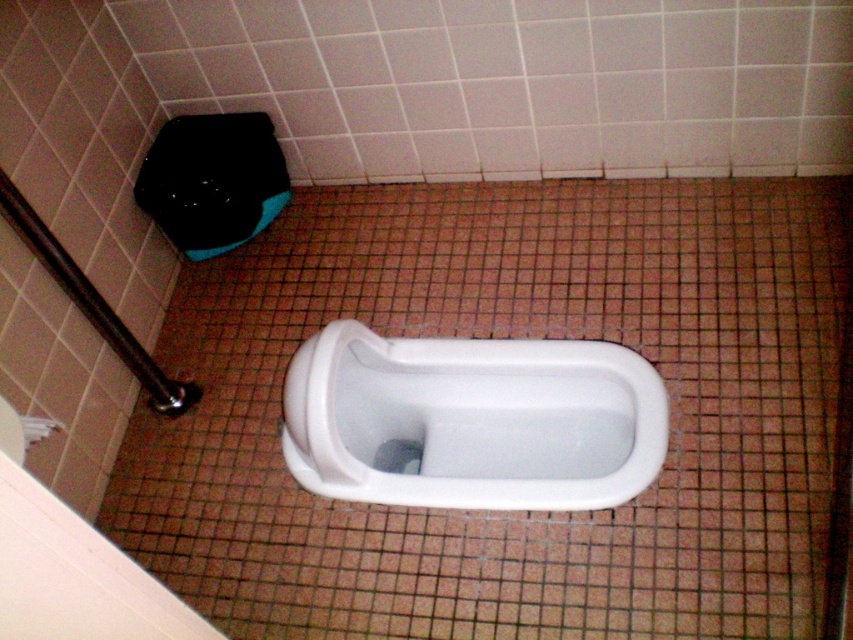
Question: Is white glossy tile at center below white paper at lower left?

Choices:
 (A) yes
 (B) no

Answer: (B)

Question: Among these points, which one is nearest to the camera?

Choices:
 (A) (25, 420)
 (B) (302, 216)

Answer: (A)

Question: Is white glossy tile at center in front of white paper at lower left?

Choices:
 (A) yes
 (B) no

Answer: (B)

Question: From the image, what is the correct spatial relationship of white glossy tile at center in relation to white paper at lower left?

Choices:
 (A) above
 (B) below

Answer: (A)

Question: Which of the following is the closest to the observer?

Choices:
 (A) (228, 621)
 (B) (560, 433)

Answer: (A)

Question: Among these points, which one is nearest to the camera?

Choices:
 (A) (33, 436)
 (B) (514, 310)
 (C) (463, 456)

Answer: (A)